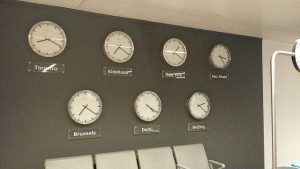
Identify the location of metal stand. This screenshot has height=169, width=300. (272, 85).